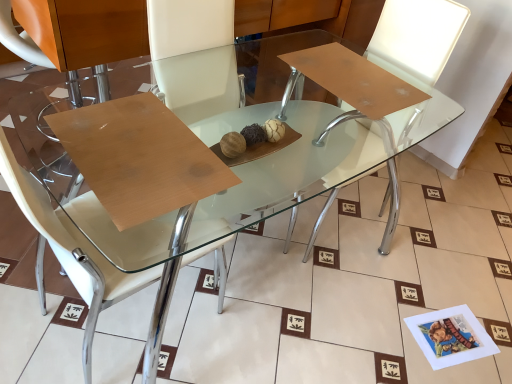
At what (x,y) coordinates should I click in order to perform the action: click on vacant position to the left of white leather chair at center, which is counted as the second chair, starting from the right. Please return your answer as a coordinate pair (x, y). The image size is (512, 384). Looking at the image, I should click on [x=27, y=296].